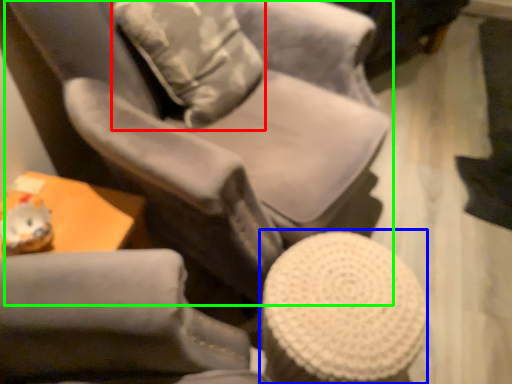
Question: Estimate the real-world distances between objects in this image. Which object is closer to throw pillow (highlighted by a red box), bar stool (highlighted by a blue box) or chair (highlighted by a green box)?

Choices:
 (A) bar stool
 (B) chair

Answer: (B)